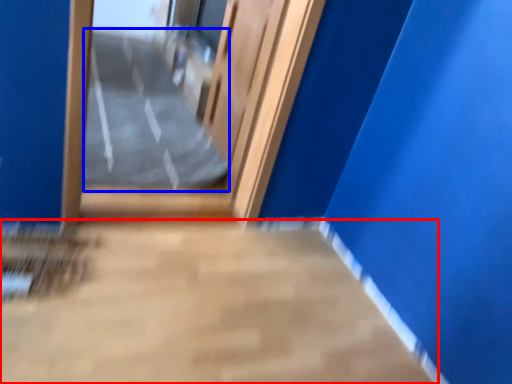
Question: Among these objects, which one is nearest to the camera, concrete (highlighted by a red box) or path (highlighted by a blue box)?

Choices:
 (A) concrete
 (B) path

Answer: (A)